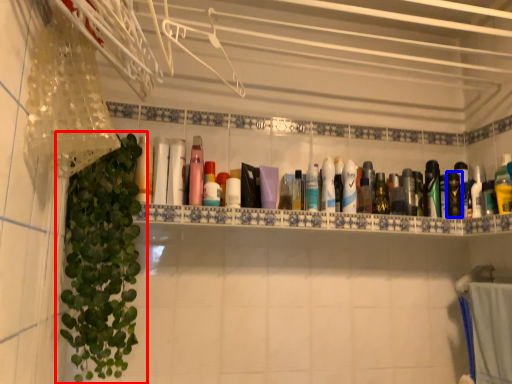
Question: Which point is closer to the camera, houseplant (highlighted by a red box) or mouthwash (highlighted by a blue box)?

Choices:
 (A) houseplant
 (B) mouthwash

Answer: (A)